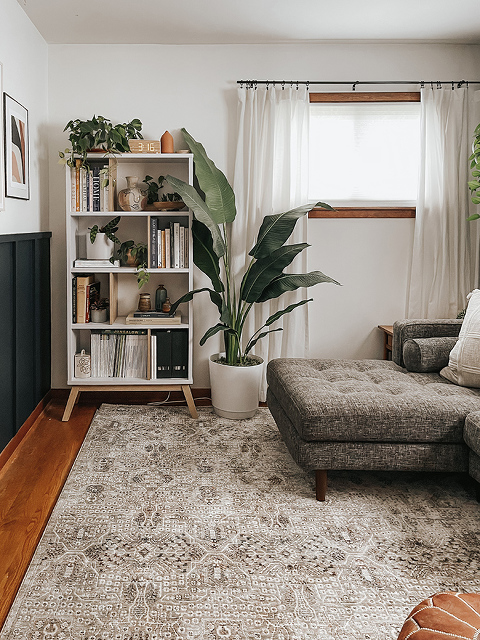
The width and height of the screenshot is (480, 640). Identify the location of couch. (382, 401), (472, 420).